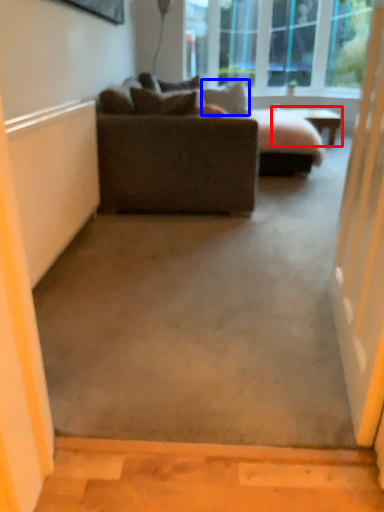
Question: Which of the following is the closest to the observer, table (highlighted by a red box) or pillow (highlighted by a blue box)?

Choices:
 (A) table
 (B) pillow

Answer: (B)